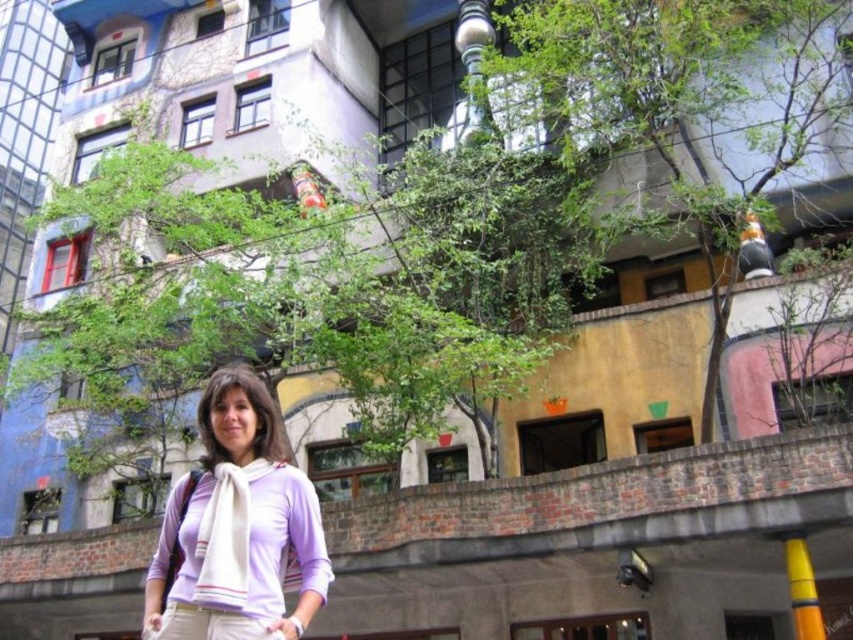
You are a photographer planning to capture a wide shot of the colorful building while including both the green leafy tree at center and the green leafy tree at upper center in the frame. Given their distance apart, will you need to adjust your camera angle to ensure both trees are fully visible in the photo?

The green leafy tree at center and green leafy tree at upper center are 14.61 meters apart from each other. To capture both trees in the same frame, you would need to adjust your camera angle or position to accommodate their distance, ensuring the entire scene is within the camera view.

You are a photographer trying to capture both the green leafy tree at center and the green leafy tree at upper center in a single shot. Which tree should you focus on first to ensure both are in frame?

You should focus on the green leafy tree at upper center first because it is farther away from the viewer, so adjusting the camera to include it will naturally include the closer green leafy tree at center as well.

In the scene shown: You are a photographer trying to capture the vibrant building in the background while ensuring the woman in the foreground doesn not block the view. Since the green leafy tree at center and the white soft scarf at center are both at the center, which one should you move to avoid blocking the building?

The green leafy tree at center is wider than the white soft scarf at center, so moving the white soft scarf at center would be more effective in avoiding blocking the building as it is narrower and easier to position aside.